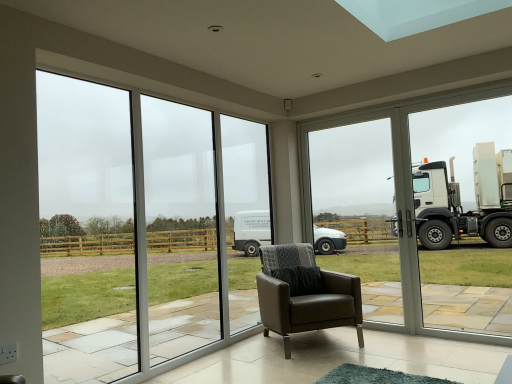
Question: From a real-world perspective, is clear glass window at right physically below transparent glass window at left?

Choices:
 (A) no
 (B) yes

Answer: (B)

Question: Is transparent glass window at left a part of clear glass window at right?

Choices:
 (A) no
 (B) yes

Answer: (A)

Question: From the image's perspective, would you say clear glass window at right is positioned over transparent glass window at left?

Choices:
 (A) yes
 (B) no

Answer: (B)

Question: Is clear glass window at right thinner than transparent glass window at left?

Choices:
 (A) yes
 (B) no

Answer: (B)

Question: Can you confirm if clear glass window at right is bigger than transparent glass window at left?

Choices:
 (A) no
 (B) yes

Answer: (B)

Question: Is brown leather armchair at center taller or shorter than transparent glass door at center?

Choices:
 (A) short
 (B) tall

Answer: (A)

Question: Is brown leather armchair at center inside or outside of transparent glass door at center?

Choices:
 (A) inside
 (B) outside

Answer: (B)

Question: From the image's perspective, is brown leather armchair at center located above or below transparent glass door at center?

Choices:
 (A) above
 (B) below

Answer: (B)

Question: In the image, is brown leather armchair at center on the left side or the right side of transparent glass door at center?

Choices:
 (A) right
 (B) left

Answer: (B)

Question: From a real-world perspective, is brown leather armchair at center above or below clear glass window at right?

Choices:
 (A) below
 (B) above

Answer: (A)

Question: From their relative heights in the image, would you say brown leather armchair at center is taller or shorter than clear glass window at right?

Choices:
 (A) tall
 (B) short

Answer: (B)

Question: Based on their positions, is brown leather armchair at center located to the left or right of clear glass window at right?

Choices:
 (A) right
 (B) left

Answer: (B)

Question: From the image's perspective, is brown leather armchair at center positioned above or below clear glass window at right?

Choices:
 (A) below
 (B) above

Answer: (A)

Question: Is point (456, 119) positioned closer to the camera than point (349, 168)?

Choices:
 (A) closer
 (B) farther

Answer: (A)

Question: From the image's perspective, is clear glass window at right positioned above or below transparent glass door at center?

Choices:
 (A) above
 (B) below

Answer: (B)